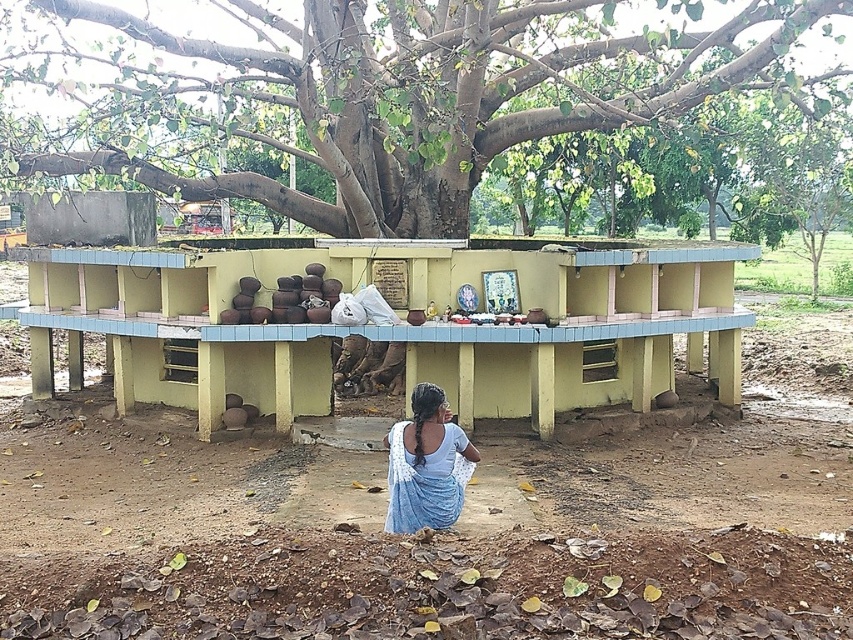
Is point (796, 397) more distant than point (171, 381)?

Yes, point (796, 397) is behind point (171, 381).

Does brown soil at lower center have a lesser width compared to yellow painted concrete bench at center?

Yes, brown soil at lower center is thinner than yellow painted concrete bench at center.

At what (x,y) coordinates should I click in order to perform the action: click on brown soil at lower center. Please return your answer as a coordinate pair (x, y). Looking at the image, I should click on (424, 540).

Does yellow painted concrete bench at center have a lesser width compared to blue fabric at lower center?

Yes.

Is point (544, 397) positioned in front of point (410, 428)?

No, (544, 397) is behind (410, 428).

Measure the distance between yellow painted concrete bench at center and camera.

The distance of yellow painted concrete bench at center from camera is 7.27 meters.

The height and width of the screenshot is (640, 853). In order to click on yellow painted concrete bench at center in this screenshot , I will do `click(393, 324)`.

Who is more forward, (251,461) or (386,157)?

Point (251,461) is in front.

Is point (741, 506) farther from camera compared to point (618, 108)?

No, (741, 506) is in front of (618, 108).

This screenshot has height=640, width=853. I want to click on brown soil at lower center, so click(x=424, y=540).